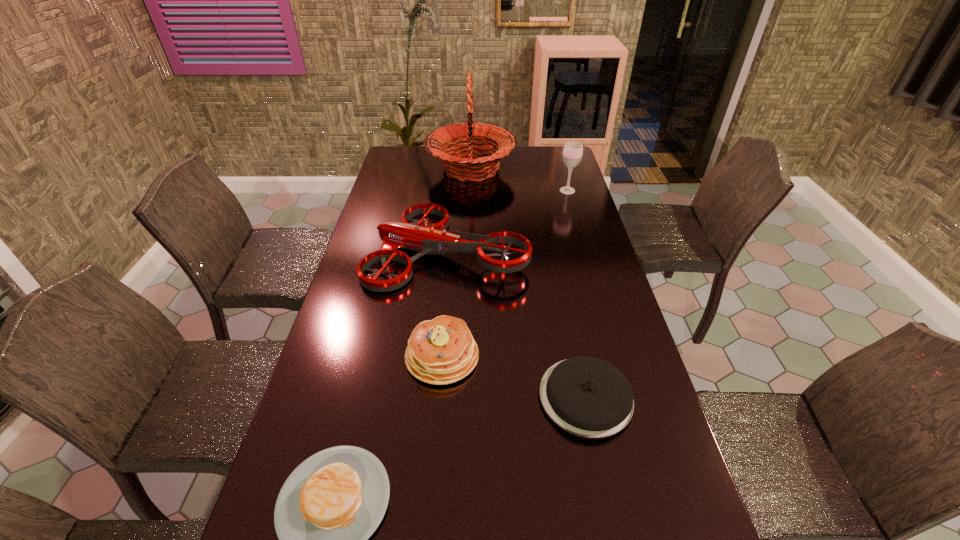
The width and height of the screenshot is (960, 540). In order to click on the tallest object in this screenshot , I will do `click(466, 137)`.

The width and height of the screenshot is (960, 540). In order to click on the second tallest object in this screenshot , I will do `click(572, 154)`.

In order to click on drone in this screenshot , I will do `click(434, 239)`.

Where is `the tallest pancake`? Image resolution: width=960 pixels, height=540 pixels. the tallest pancake is located at coordinates (x=441, y=351).

The image size is (960, 540). What are the coordinates of `the rightmost pancake` in the screenshot? It's located at (587, 397).

The height and width of the screenshot is (540, 960). What are the coordinates of `free space located 0.120m on the front of the basket` in the screenshot? It's located at (469, 207).

The height and width of the screenshot is (540, 960). What are the coordinates of `vacant point located on the front of the wineglass` in the screenshot? It's located at (580, 233).

I want to click on free region located 0.150m on the back of the drone, so click(452, 193).

Where is `free space located 0.270m on the front of the tallest pancake`? free space located 0.270m on the front of the tallest pancake is located at coordinates (431, 495).

What are the coordinates of `vacant space located on the left of the rightmost pancake` in the screenshot? It's located at (396, 397).